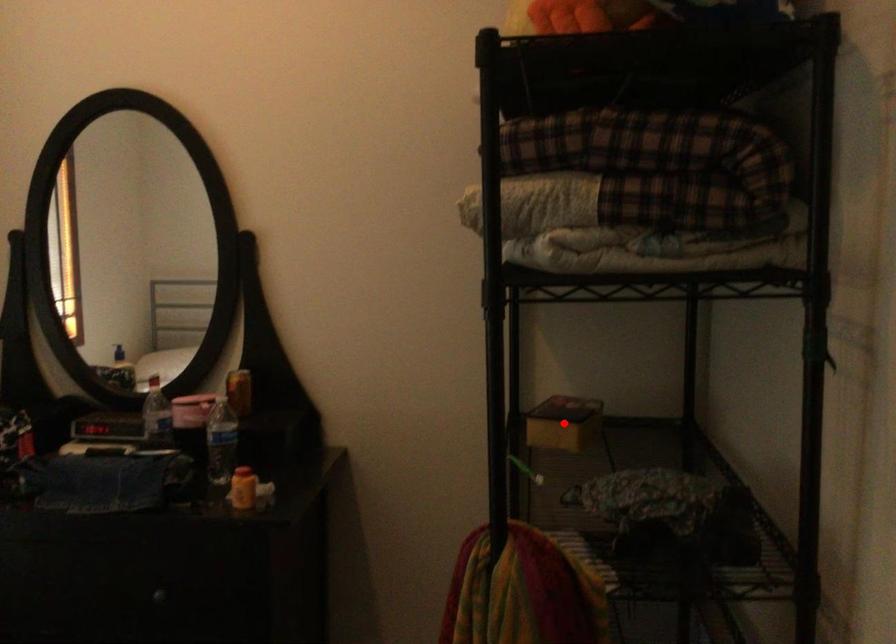
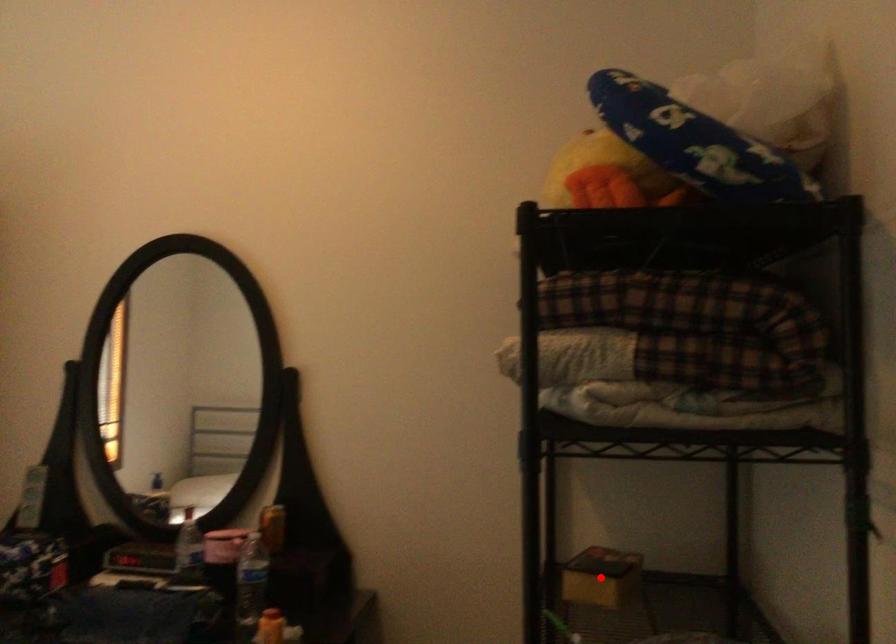
I am providing you with two images of the same scene from different viewpoints. A red point is marked on the first image and another point is marked on the second image. Do the highlighted points in image1 and image2 indicate the same real-world spot?

Yes